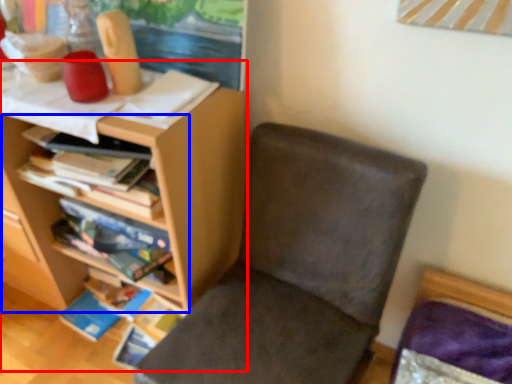
Question: Which point is closer to the camera, shelf (highlighted by a red box) or shelf (highlighted by a blue box)?

Choices:
 (A) shelf
 (B) shelf

Answer: (A)